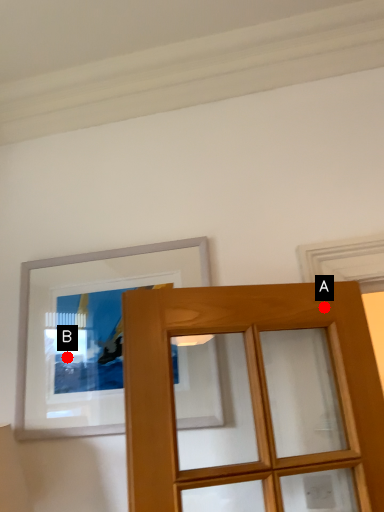
Question: Two points are circled on the image, labeled by A and B beside each circle. Among these points, which one is farthest from the camera?

Choices:
 (A) A is further
 (B) B is further

Answer: (B)